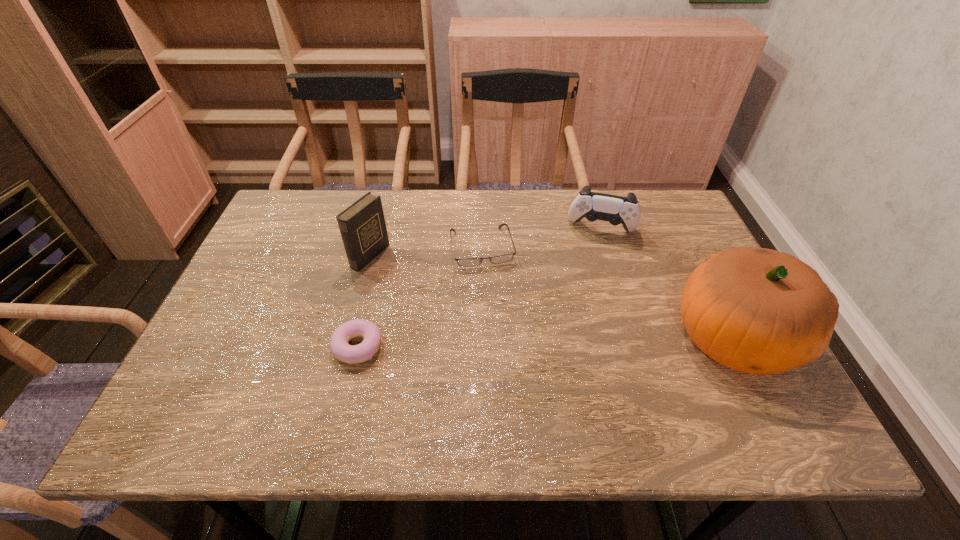
Where is `vacant space that satisfies the following two spatial constraints: 1. on the back side of the control; 2. on the right side of the diary`? The height and width of the screenshot is (540, 960). vacant space that satisfies the following two spatial constraints: 1. on the back side of the control; 2. on the right side of the diary is located at coordinates (377, 229).

I want to click on free space that satisfies the following two spatial constraints: 1. on the front side of the pumpkin; 2. on the face of the fourth shortest object, so click(348, 338).

Find the location of a particular element. blank area in the image that satisfies the following two spatial constraints: 1. on the back side of the pumpkin; 2. on the face of the doughnut is located at coordinates (360, 338).

Identify the location of vacant region that satisfies the following two spatial constraints: 1. on the back side of the diary; 2. on the right side of the third object from left to right. (372, 247).